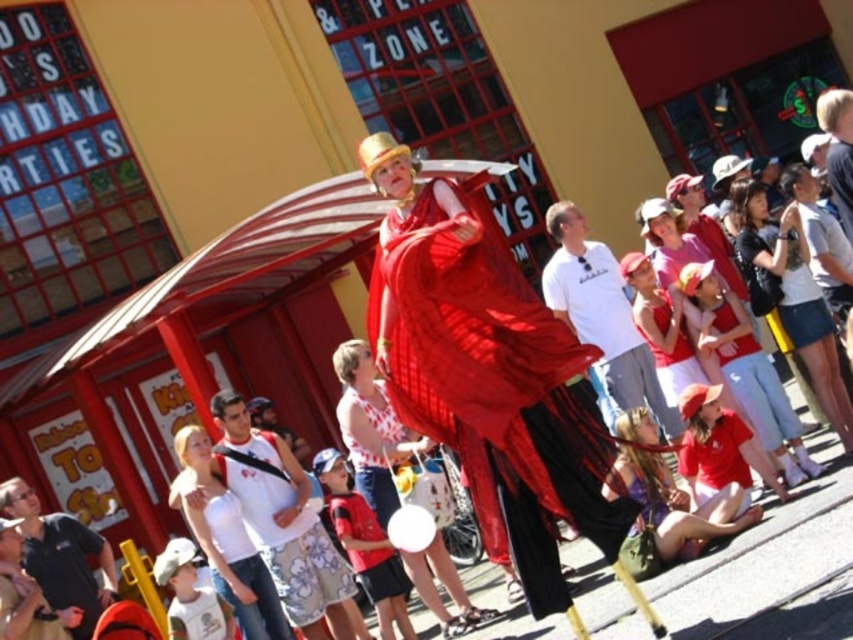
You are an event planner trying to place a new banner. The banner must be placed at the point where the shiny red cape at center is located. Is the point at coordinates (490,381) suitable for placing the banner?

The point at coordinates (490,381) is where the shiny red cape at center is located, so placing the banner there would cover the cape. Choose a different location to avoid blocking the performer.